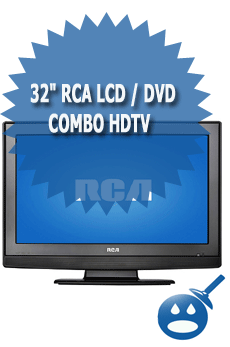
In order to click on tv screen in this screenshot , I will do `click(166, 217)`.